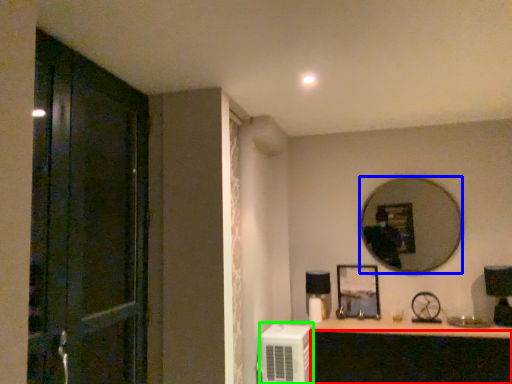
Question: Which object is the closest to the cabinetry (highlighted by a red box)? Choose among these: mirror (highlighted by a blue box) or air conditioner (highlighted by a green box).

Choices:
 (A) mirror
 (B) air conditioner

Answer: (B)